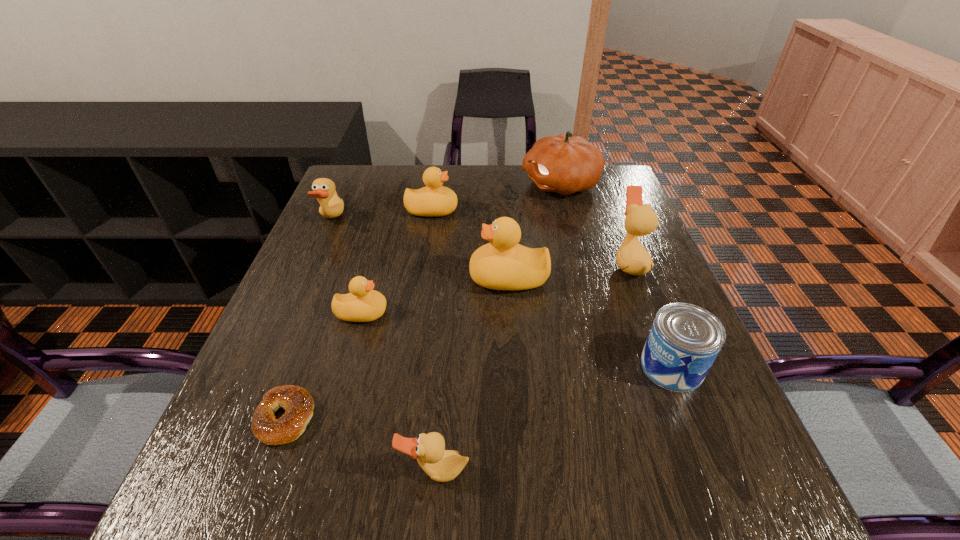
Find the location of a particular element. This screenshot has width=960, height=540. the second nearest duck is located at coordinates (363, 304).

I want to click on the nearest object, so click(441, 465).

The height and width of the screenshot is (540, 960). In order to click on the smallest tan duck in this screenshot , I will do `click(441, 465)`.

Locate an element on the screen. brown bagel is located at coordinates (297, 402).

This screenshot has height=540, width=960. I want to click on bagel, so click(297, 402).

The width and height of the screenshot is (960, 540). I want to click on vacant space positioned 0.180m on the front face of the pumpkin, so click(x=462, y=184).

Where is `free space located 0.080m on the front face of the pumpkin`? The width and height of the screenshot is (960, 540). free space located 0.080m on the front face of the pumpkin is located at coordinates (494, 184).

Identify the location of blank space located on the front face of the pumpkin. The width and height of the screenshot is (960, 540). (439, 184).

In order to click on vacant area situated on the face of the rightmost yellow duck in this screenshot , I will do point(357,278).

What are the coordinates of `free space located 0.120m on the face of the rightmost yellow duck` in the screenshot? It's located at click(418, 278).